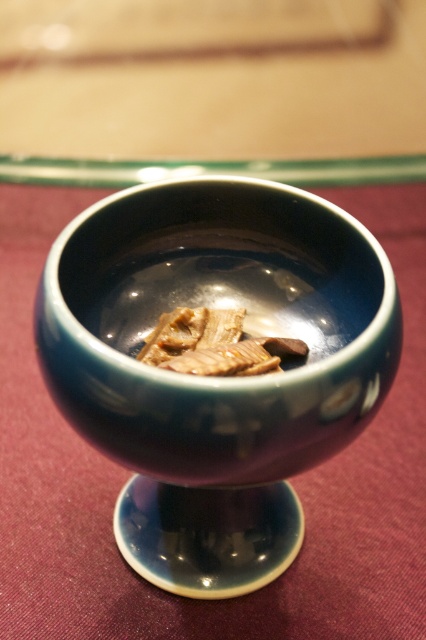
You are arranging food on a table and need to place the blue glossy bowl at center and the brown matte meat at center in a specific layout. According to the image, which object is located to the left of the other?

The blue glossy bowl at center is positioned on the left side of brown matte meat at center, so the blue glossy bowl at center is to the left of the brown matte meat at center.

You are arranging food on a table and need to place the brown matte meat at center so it can be seen clearly. However, there is already a blue glossy bowl at center in the way. Based on the scene description, how can you adjust the arrangement to ensure the meat is visible without moving the bowl?

Since the brown matte meat at center is currently behind the blue glossy bowl at center, you can move the meat to a position in front of the bowl to make it visible while keeping the bowl in place.